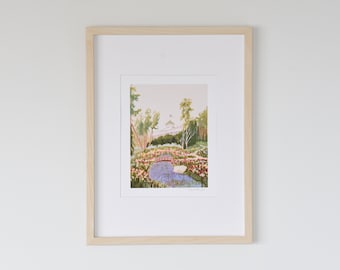
Identify the location of bottom right corner of painting. (206, 187).